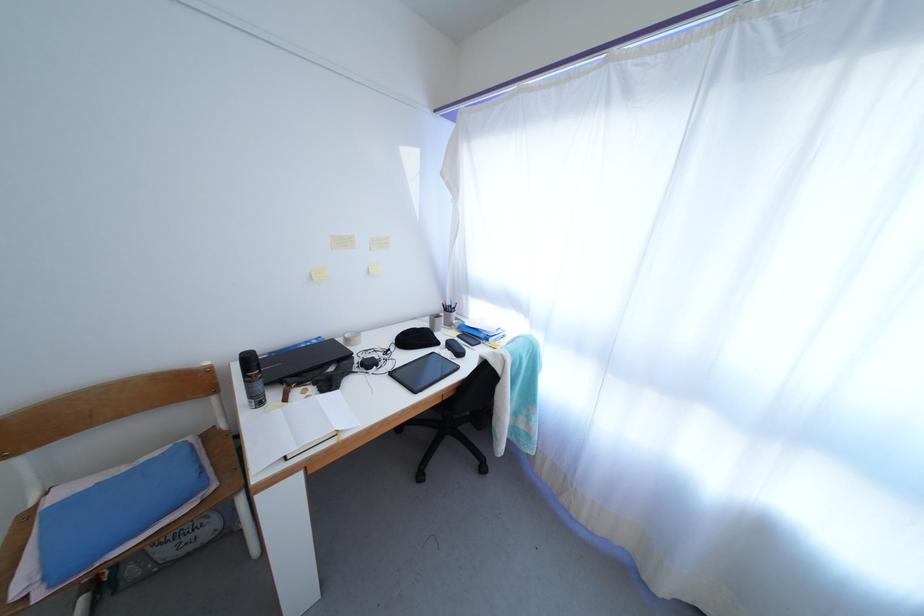
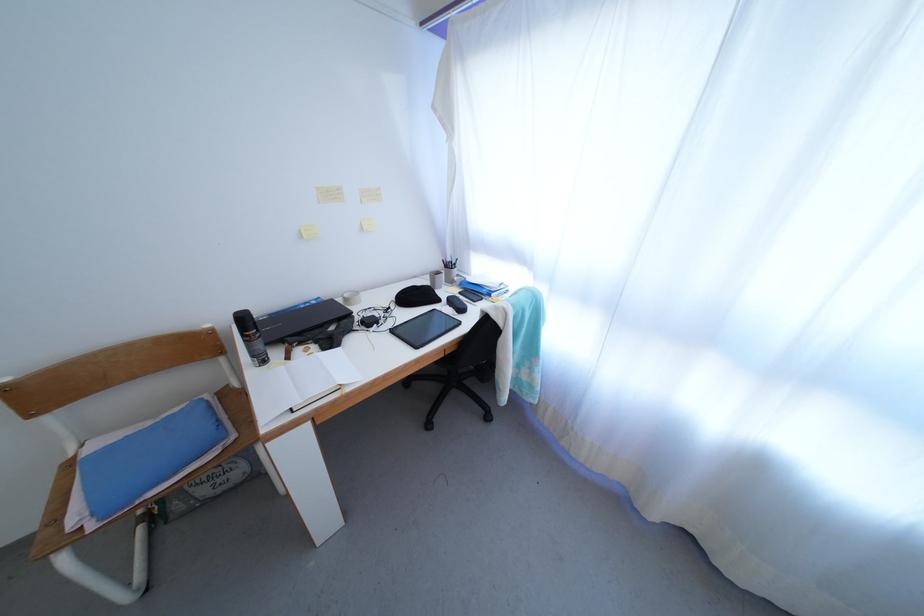
Question: How did the camera likely rotate?

Choices:
 (A) Left
 (B) Right
 (C) Up
 (D) Down

Answer: (D)